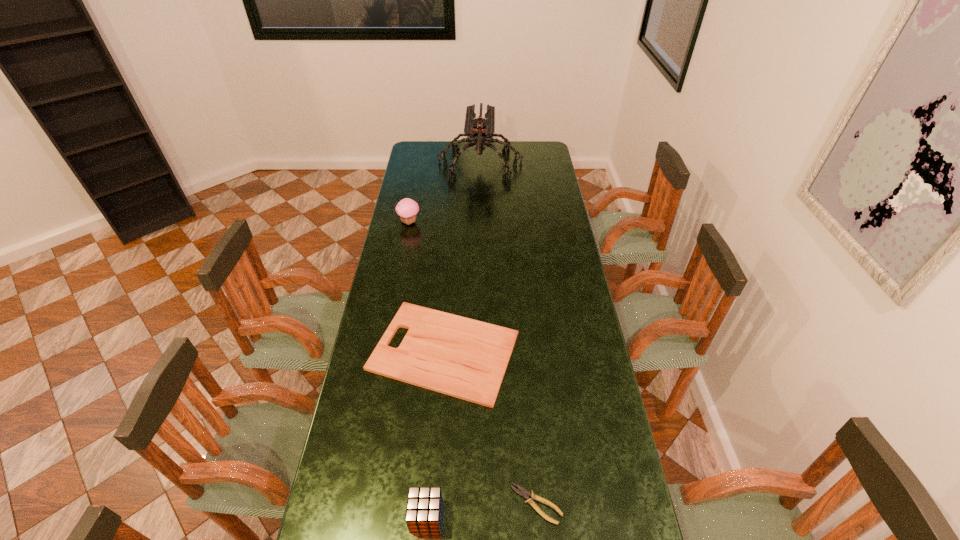
In order to click on the tallest object in this screenshot , I will do `click(480, 131)`.

At what (x,y) coordinates should I click in order to perform the action: click on drone. Please return your answer as a coordinate pair (x, y). The height and width of the screenshot is (540, 960). Looking at the image, I should click on (480, 131).

Locate an element on the screen. Image resolution: width=960 pixels, height=540 pixels. cupcake is located at coordinates point(407,209).

The width and height of the screenshot is (960, 540). Identify the location of the second farthest object. (407, 209).

Find the location of a particular element. This screenshot has width=960, height=540. cube is located at coordinates (424, 507).

The height and width of the screenshot is (540, 960). Identify the location of the fourth tallest object. (461, 357).

The image size is (960, 540). In order to click on chopping board in this screenshot , I will do `click(461, 357)`.

Find the location of a particular element. pliers is located at coordinates (523, 492).

The width and height of the screenshot is (960, 540). In order to click on free space located on the front of the drone in this screenshot , I will do `click(480, 234)`.

What are the coordinates of `vacant region located 0.200m on the back of the fourth shortest object` in the screenshot? It's located at (415, 192).